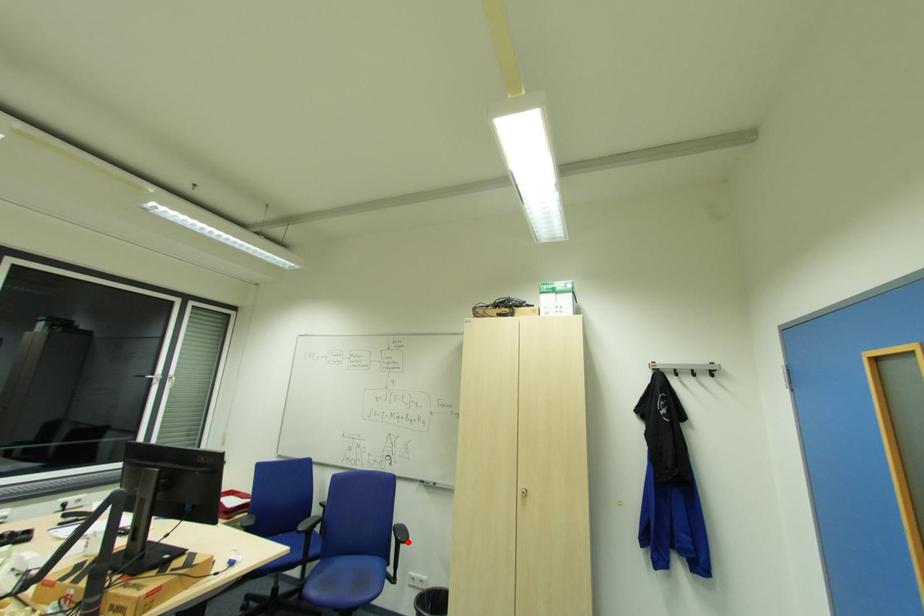
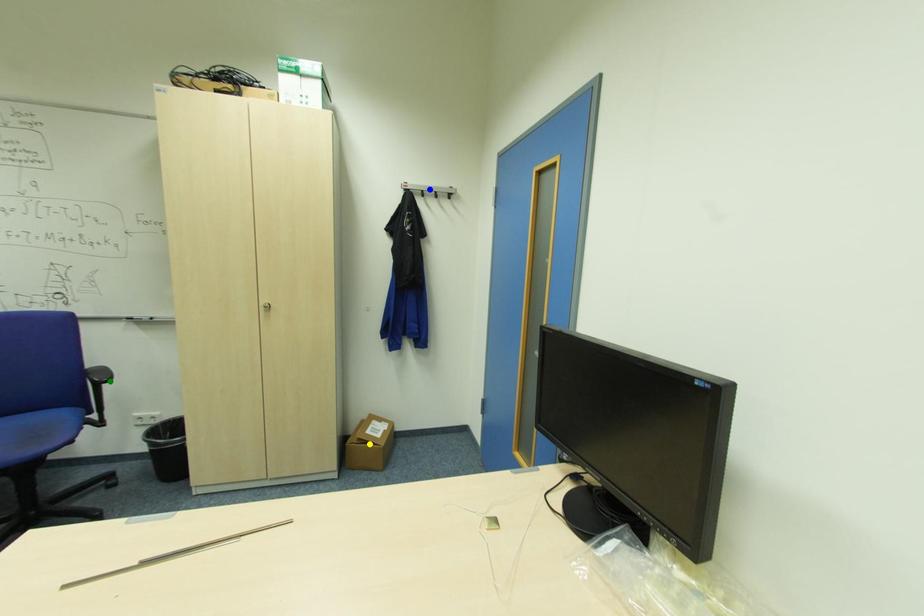
Question: I am providing you with two images of the same scene from different viewpoints. A red point is marked on the first image. You are given multiple points on the second image. Which mark in image 2 goes with the point in image 1?

Choices:
 (A) blue point
 (B) yellow point
 (C) green point

Answer: (C)